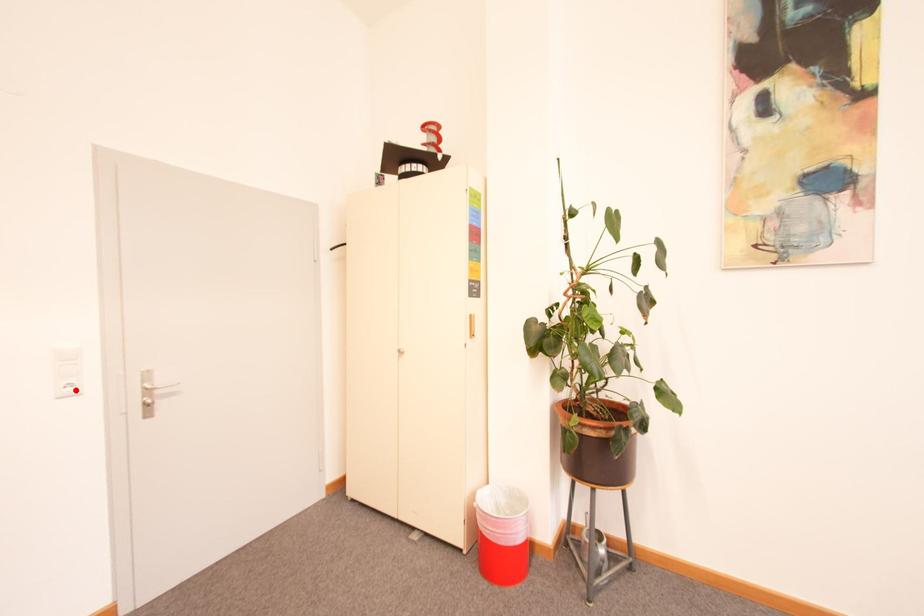
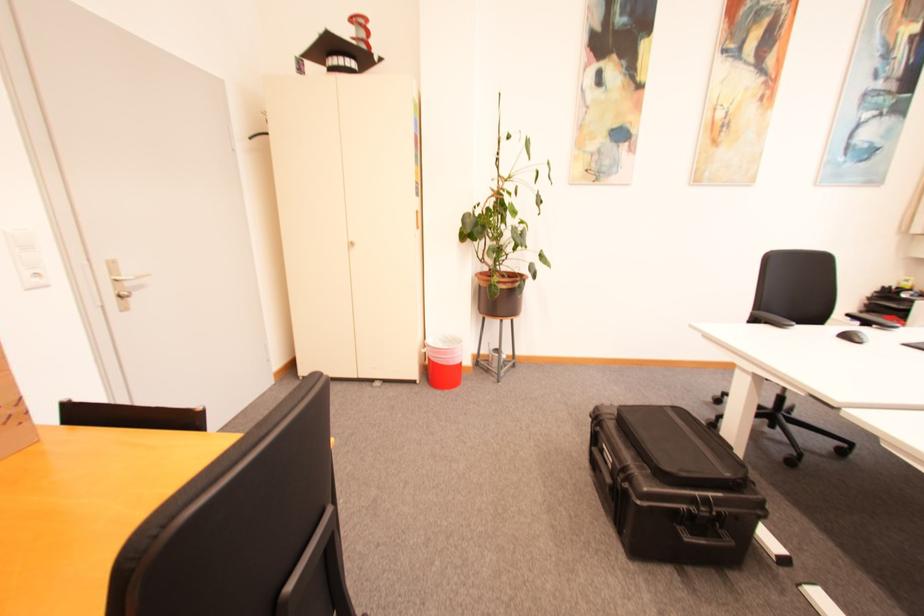
The point at the highlighted location is marked in the first image. Where is the corresponding point in the second image?

(43, 281)